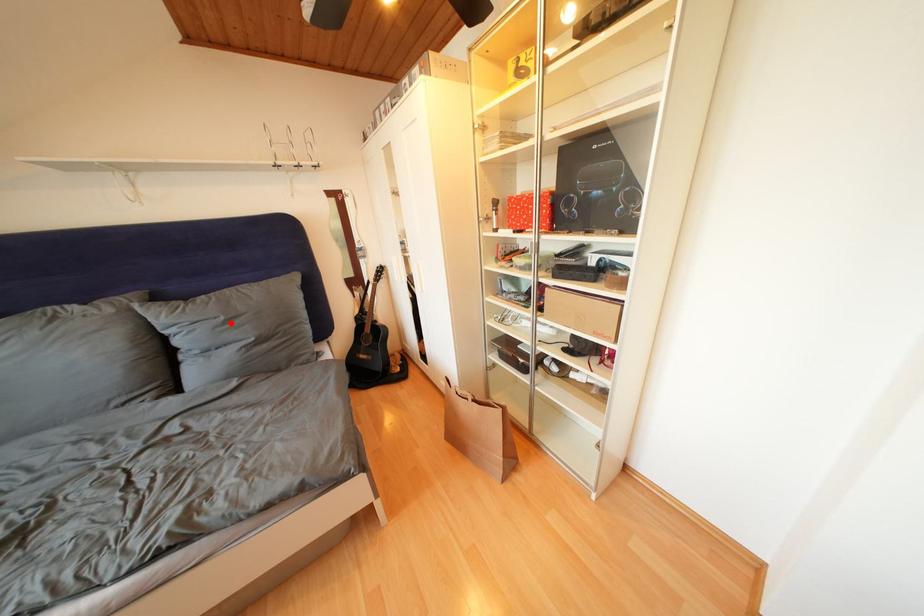
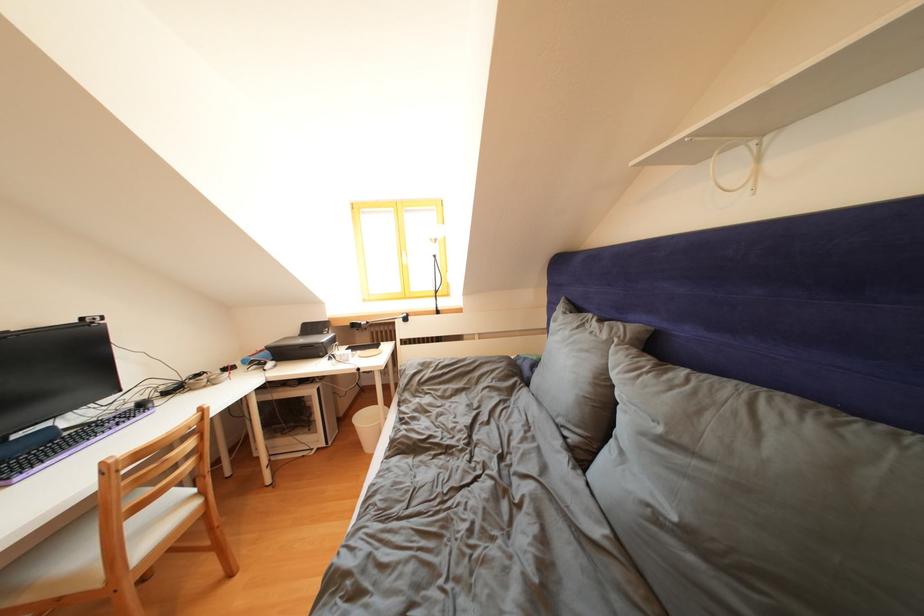
In the second image, find the point that corresponds to the highlighted location in the first image.

(667, 435)